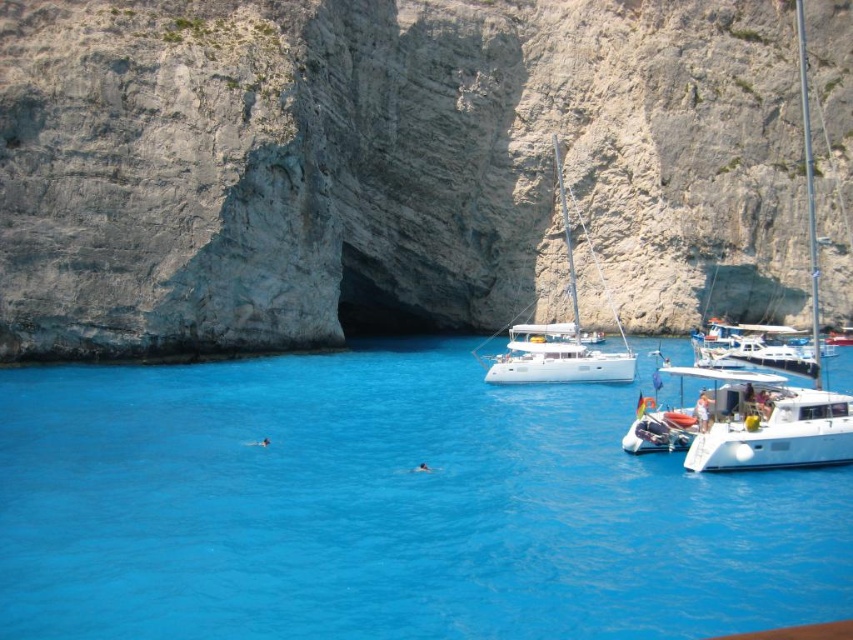
Can you confirm if white glossy sailboat at right is thinner than white glossy catamaran at lower right?

No.

Which is behind, point (824, 412) or point (735, 467)?

Positioned behind is point (824, 412).

Is point (735, 397) positioned before point (703, 440)?

No, it is behind (703, 440).

The height and width of the screenshot is (640, 853). Identify the location of white glossy sailboat at right. (775, 376).

What do you see at coordinates (387, 168) in the screenshot? This screenshot has height=640, width=853. I see `gray rocky cliff at center` at bounding box center [387, 168].

Is gray rocky cliff at center closer to camera compared to white glossy catamaran at lower right?

No.

Who is more distant from viewer, [306,172] or [741,440]?

The point [306,172] is behind.

Find the location of a particular element. gray rocky cliff at center is located at coordinates (387, 168).

Which is behind, point (419, 484) or point (793, 460)?

Point (419, 484)

Is point (634, 600) less distant than point (775, 364)?

Yes, point (634, 600) is in front of point (775, 364).

Where is `transparent blue water at center`? This screenshot has height=640, width=853. transparent blue water at center is located at coordinates (386, 509).

Where is `transparent blue water at center`? This screenshot has height=640, width=853. transparent blue water at center is located at coordinates (386, 509).